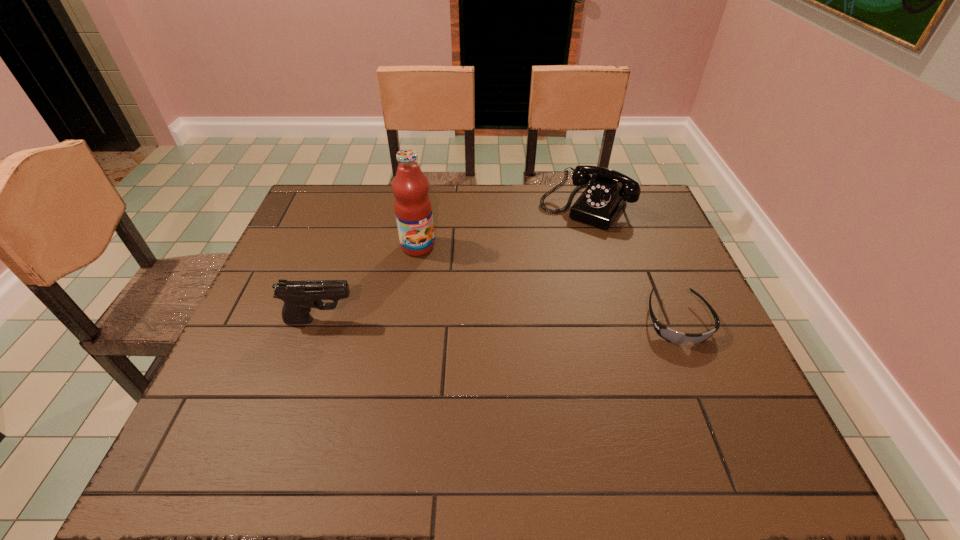
You are a GUI agent. You are given a task and a screenshot of the screen. Output one action in this format:
    pyautogui.click(x=<x>, y=<y>)
    Task: Click on the free space located on the dial of the telephone
    
    Given the screenshot: What is the action you would take?
    pyautogui.click(x=560, y=237)

The image size is (960, 540). In order to click on vacant point located on the dial of the telephone in this screenshot , I will do `click(554, 245)`.

You are a GUI agent. You are given a task and a screenshot of the screen. Output one action in this format:
    pyautogui.click(x=<x>, y=<y>)
    Task: Click on the object located at the far edge
    
    Given the screenshot: What is the action you would take?
    pyautogui.click(x=600, y=203)

Identify the location of object positioned at the left edge. (299, 297).

You are a GUI agent. You are given a task and a screenshot of the screen. Output one action in this format:
    pyautogui.click(x=<x>, y=<y>)
    Task: Click on the sunglasses located in the right edge section of the desktop
    This screenshot has height=540, width=960.
    Given the screenshot: What is the action you would take?
    pyautogui.click(x=670, y=335)

At what (x,y) coordinates should I click in order to perform the action: click on telephone at the right edge. Please return your answer as a coordinate pair (x, y). This screenshot has height=540, width=960. Looking at the image, I should click on (600, 203).

Find the location of a particular element. object that is at the far right corner is located at coordinates (600, 203).

In the image, there is a desktop. Identify the location of vacant space at the far edge. (492, 208).

Identify the location of vacant area at the left edge. tap(281, 315).

The image size is (960, 540). Identify the location of blank space at the right edge of the desktop. (627, 241).